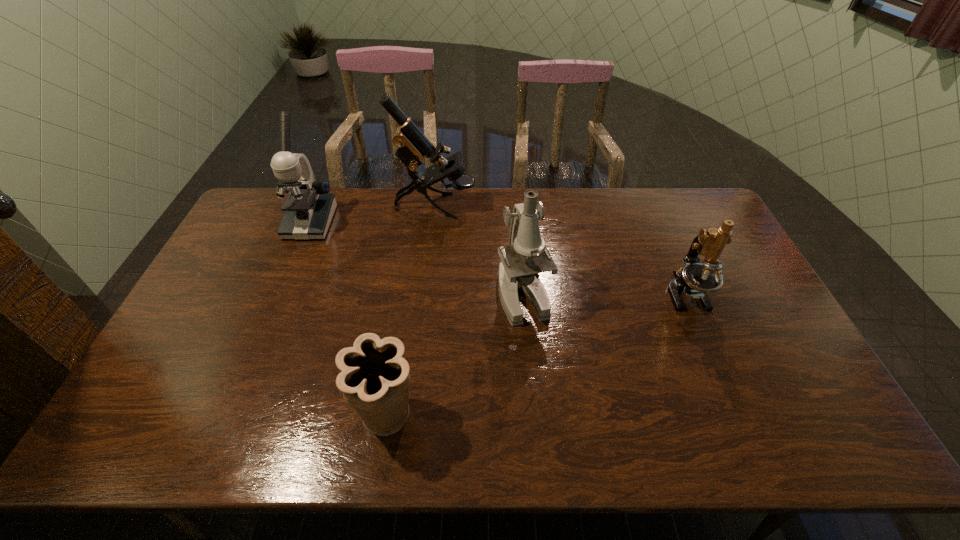
You are a GUI agent. You are given a task and a screenshot of the screen. Output one action in this format:
    pyautogui.click(x=<x>, y=<y>)
    Task: Click on the second microscope from left to right
    
    Given the screenshot: What is the action you would take?
    pyautogui.click(x=413, y=145)

Locate an element on the screen. This screenshot has width=960, height=540. the leftmost microscope is located at coordinates (309, 207).

The width and height of the screenshot is (960, 540). In order to click on the second object from right to left in this screenshot , I will do `click(526, 255)`.

I want to click on the rightmost microscope, so click(695, 279).

Identify the location of the rightmost object. (695, 279).

Locate an element on the screen. This screenshot has width=960, height=540. the nearest object is located at coordinates (375, 380).

Where is `urn`? This screenshot has height=540, width=960. urn is located at coordinates (375, 380).

Locate an element on the screen. The image size is (960, 540). vacant space located through the eyepiece of the second microscope from left to right is located at coordinates (584, 206).

Find the location of `free space located 0.180m on the front of the leftmost object`. free space located 0.180m on the front of the leftmost object is located at coordinates (286, 280).

The height and width of the screenshot is (540, 960). Identify the location of free space located on the left of the third microscope from left to right. (457, 295).